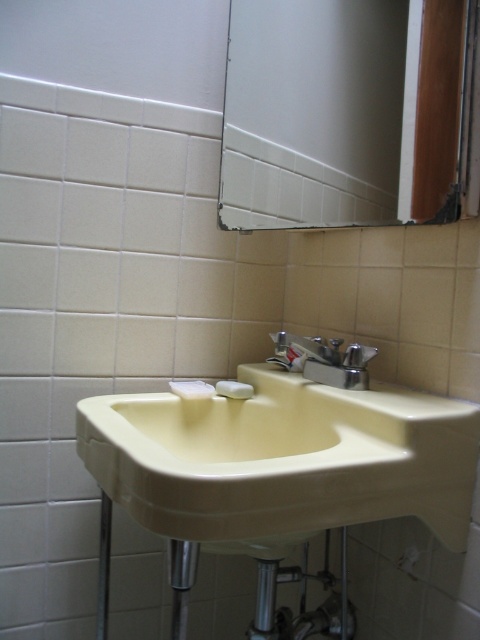
Does silver metallic faucet at upper center have a lesser height compared to white matte soap at sink?

No, silver metallic faucet at upper center is not shorter than white matte soap at sink.

Who is taller, silver metallic faucet at upper center or white matte soap at sink?

silver metallic faucet at upper center is taller.

Is point (299, 348) farther from camera compared to point (222, 388)?

That is False.

Image resolution: width=480 pixels, height=640 pixels. In order to click on silver metallic faucet at upper center in this screenshot , I will do `click(300, 349)`.

Does beige porcelain sink at center have a smaller size compared to silver metallic faucet at upper center?

No, beige porcelain sink at center is not smaller than silver metallic faucet at upper center.

Between point (339, 400) and point (336, 352), which one is positioned behind?

The point (336, 352) is more distant.

Locate an element on the screen. beige porcelain sink at center is located at coordinates (283, 460).

Which is above, matte glass mirror at upper center or white matte soap at sink?

matte glass mirror at upper center

The width and height of the screenshot is (480, 640). Describe the element at coordinates (349, 113) in the screenshot. I see `matte glass mirror at upper center` at that location.

Locate an element on the screen. matte glass mirror at upper center is located at coordinates (349, 113).